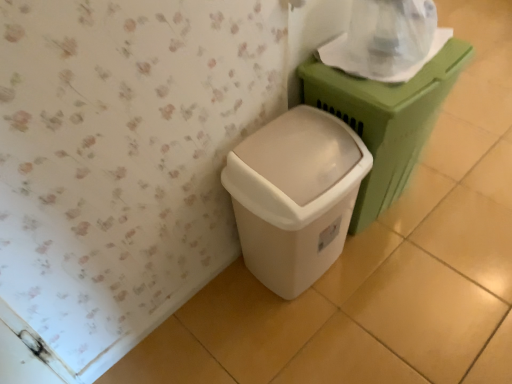
Where is `free space above white plastic waste container at lower center, the second waste container viewed from the right (from a real-world perspective)`? free space above white plastic waste container at lower center, the second waste container viewed from the right (from a real-world perspective) is located at coordinates (314, 163).